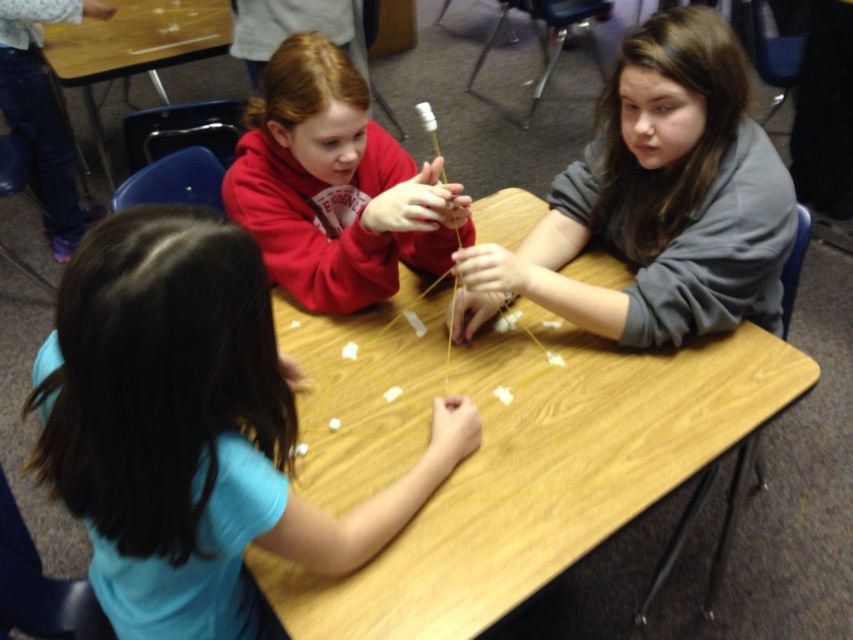
Please provide the coordinates of the wooden table at center in the image.

The wooden table at center is located at coordinates point (544, 474).

You are standing at the origin point of the coordinate system where the camera is positioned. The gray matte sweater at upper right is located at point (657,200). If you want to move towards the gray matte sweater at upper right, in which direction should you move?

To move towards the gray matte sweater at upper right located at point (657,200), you should move northeast since the coordinates are positive in both x and y directions.

Looking at this image, you are a photographer trying to capture a closeup of the bead activity. You notice two points on the table where beads are scattered. The first is at point (558, 371) and the second at point (709, 116). Which point would you focus on to get a clearer image of the beads closer to the camera?

Point (558, 371) is further to the camera than point (709, 116), so focusing on point (558, 371) would capture the beads closer to the camera more clearly.